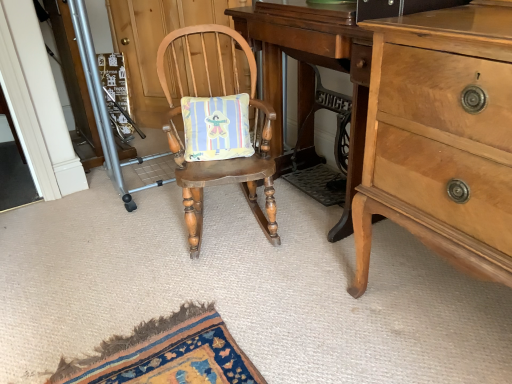
Image resolution: width=512 pixels, height=384 pixels. Identify the location of wooden rocking chair at center. click(x=249, y=123).

This screenshot has width=512, height=384. Describe the element at coordinates (441, 137) in the screenshot. I see `light brown wood dresser at right` at that location.

Locate an element on the screen. The height and width of the screenshot is (384, 512). light brown wood changing table at center is located at coordinates (311, 70).

Is light brown wood dresser at right spatially inside light brown wood changing table at center, or outside of it?

light brown wood dresser at right is outside light brown wood changing table at center.

How many degrees apart are the facing directions of light brown wood dresser at right and light brown wood changing table at center?

1.2e-05 degrees separate the facing orientations of light brown wood dresser at right and light brown wood changing table at center.

Is light brown wood dresser at right turned away from light brown wood changing table at center?

No, light brown wood dresser at right's orientation is not away from light brown wood changing table at center.

Considering the positions of objects light brown wood changing table at center and light brown wood dresser at right in the image provided, who is more to the left, light brown wood changing table at center or light brown wood dresser at right?

From the viewer's perspective, light brown wood changing table at center appears more on the left side.

Does light brown wood changing table at center have a greater height compared to light brown wood dresser at right?

In fact, light brown wood changing table at center may be shorter than light brown wood dresser at right.

In the scene shown: Can you tell me how much light brown wood changing table at center and light brown wood dresser at right differ in facing direction?

light brown wood changing table at center and light brown wood dresser at right are facing 1.2e-05 degrees away from each other.

From the image's perspective, is light brown wood changing table at center below light brown wood dresser at right?

Actually, light brown wood changing table at center appears above light brown wood dresser at right in the image.

From the image's perspective, which object appears higher, metallic silver screen door at left or light brown wood dresser at right?

metallic silver screen door at left appears higher in the image.

Does metallic silver screen door at left have a greater height compared to light brown wood dresser at right?

Yes.

Could you tell me if metallic silver screen door at left is facing light brown wood dresser at right?

No, metallic silver screen door at left does not turn towards light brown wood dresser at right.

In the image, is metallic silver screen door at left positioned in front of or behind light brown wood dresser at right?

metallic silver screen door at left is behind light brown wood dresser at right.

How different are the orientations of metallic silver screen door at left and wooden rocking chair at center in degrees?

111 degrees.

Is metallic silver screen door at left positioned with its back to wooden rocking chair at center?

metallic silver screen door at left does not have its back to wooden rocking chair at center.

Which is more to the right, metallic silver screen door at left or wooden rocking chair at center?

Positioned to the right is wooden rocking chair at center.

Is metallic silver screen door at left thinner than wooden rocking chair at center?

Yes.

Is wooden rocking chair at center located within light brown wood dresser at right?

No, wooden rocking chair at center is not surrounded by light brown wood dresser at right.

Can you confirm if light brown wood dresser at right is taller than wooden rocking chair at center?

Yes, light brown wood dresser at right is taller than wooden rocking chair at center.

Relative to wooden rocking chair at center, is light brown wood dresser at right in front or behind?

In the image, light brown wood dresser at right appears in front of wooden rocking chair at center.

From the image's perspective, who appears lower, light brown wood dresser at right or wooden rocking chair at center?

light brown wood dresser at right, from the image's perspective.

Where is `cabinetry below the metallic silver screen door at left (from the image's perspective)`? This screenshot has width=512, height=384. cabinetry below the metallic silver screen door at left (from the image's perspective) is located at coordinates pos(441,137).

Does light brown wood dresser at right touch metallic silver screen door at left?

No.

Looking at this image, from the image's perspective, which object appears higher, light brown wood dresser at right or metallic silver screen door at left?

metallic silver screen door at left is shown above in the image.

Measure the distance from light brown wood changing table at center to wooden rocking chair at center.

A distance of 9.26 inches exists between light brown wood changing table at center and wooden rocking chair at center.

Which of these two, light brown wood changing table at center or wooden rocking chair at center, is thinner?

With smaller width is light brown wood changing table at center.

Can you tell me how much light brown wood changing table at center and wooden rocking chair at center differ in facing direction?

The facing directions of light brown wood changing table at center and wooden rocking chair at center are 68.8 degrees apart.

From a real-world perspective, between light brown wood changing table at center and wooden rocking chair at center, who is vertically higher?

light brown wood changing table at center.

This screenshot has width=512, height=384. There is a light brown wood changing table at center. Identify the location of cabinetry above it (from a real-world perspective). [x=441, y=137].

The width and height of the screenshot is (512, 384). I want to click on changing table that is under the light brown wood dresser at right (from a real-world perspective), so click(311, 70).

From the image, which object appears to be nearer to metallic silver screen door at left, light brown wood changing table at center or wooden rocking chair at center?

The object closer to metallic silver screen door at left is wooden rocking chair at center.

Looking at the image, which one is located closer to metallic silver screen door at left, wooden rocking chair at center or light brown wood changing table at center?

wooden rocking chair at center lies closer to metallic silver screen door at left than the other object.

Which object lies further to the anchor point light brown wood changing table at center, wooden rocking chair at center or metallic silver screen door at left?

metallic silver screen door at left.

Consider the image. Estimate the real-world distances between objects in this image. Which object is further from light brown wood changing table at center, metallic silver screen door at left or wooden rocking chair at center?

metallic silver screen door at left.

Estimate the real-world distances between objects in this image. Which object is closer to light brown wood dresser at right, light brown wood changing table at center or metallic silver screen door at left?

The object closer to light brown wood dresser at right is light brown wood changing table at center.

Consider the image. Estimate the real-world distances between objects in this image. Which object is further from light brown wood dresser at right, wooden rocking chair at center or metallic silver screen door at left?

The object further to light brown wood dresser at right is metallic silver screen door at left.

Estimate the real-world distances between objects in this image. Which object is closer to metallic silver screen door at left, wooden rocking chair at center or light brown wood dresser at right?

Based on the image, wooden rocking chair at center appears to be nearer to metallic silver screen door at left.

Based on their spatial positions, is light brown wood changing table at center or light brown wood dresser at right closer to wooden rocking chair at center?

light brown wood changing table at center is closer to wooden rocking chair at center.

Locate an element on the screen. changing table situated between wooden rocking chair at center and light brown wood dresser at right from left to right is located at coordinates click(x=311, y=70).

This screenshot has width=512, height=384. I want to click on changing table between metallic silver screen door at left and light brown wood dresser at right in the horizontal direction, so click(311, 70).

Identify the location of chair situated between metallic silver screen door at left and light brown wood changing table at center from left to right. (249, 123).

Locate an element on the screen. The image size is (512, 384). chair situated between metallic silver screen door at left and light brown wood dresser at right from left to right is located at coordinates (249, 123).